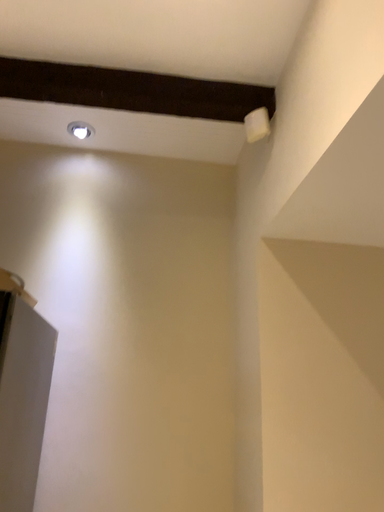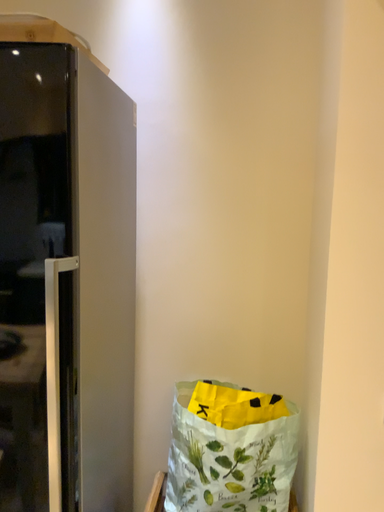
Question: Which way did the camera rotate in the video?

Choices:
 (A) rotated left
 (B) rotated right

Answer: (A)